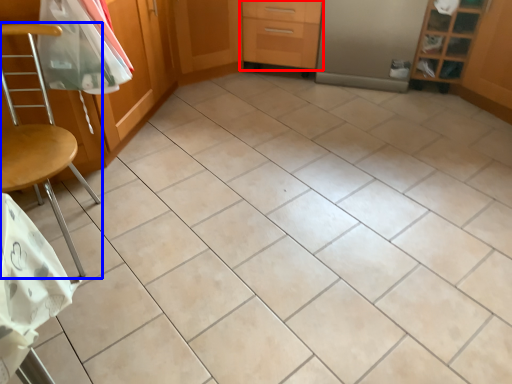
Question: Which object appears farthest to the camera in this image, drawer (highlighted by a red box) or chair (highlighted by a blue box)?

Choices:
 (A) drawer
 (B) chair

Answer: (A)